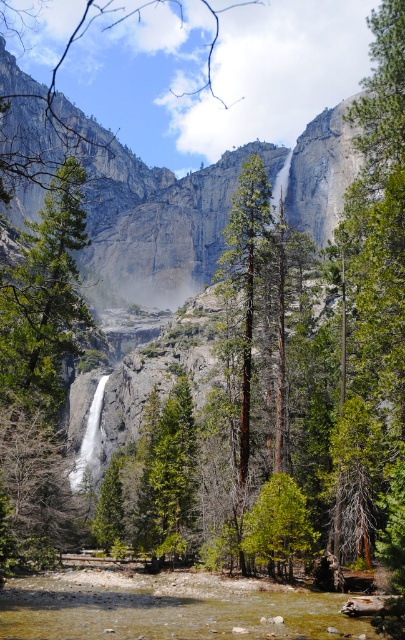
Question: Does clear water at lower center have a greater width compared to brown rough tree at center?

Choices:
 (A) no
 (B) yes

Answer: (B)

Question: Is green matte tree at left closer to the viewer compared to brown rough tree at center?

Choices:
 (A) no
 (B) yes

Answer: (B)

Question: Where is gray rock face at center located in relation to green matte tree at center in the image?

Choices:
 (A) right
 (B) left

Answer: (B)

Question: Which object appears closest to the camera in this image?

Choices:
 (A) green matte tree at left
 (B) green matte tree at center
 (C) gray rock face at center
 (D) clear water at lower center

Answer: (D)

Question: Among these points, which one is nearest to the camera?

Choices:
 (A) (208, 269)
 (B) (259, 515)
 (C) (251, 282)
 (D) (345, 627)

Answer: (D)

Question: Which object appears farthest from the camera in this image?

Choices:
 (A) green matte tree at center
 (B) brown rough tree at center

Answer: (B)